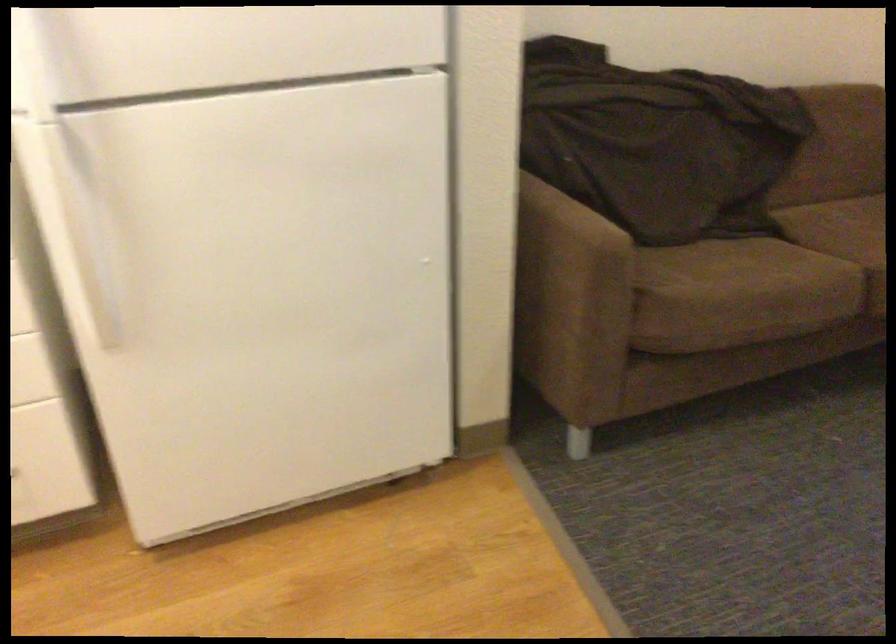
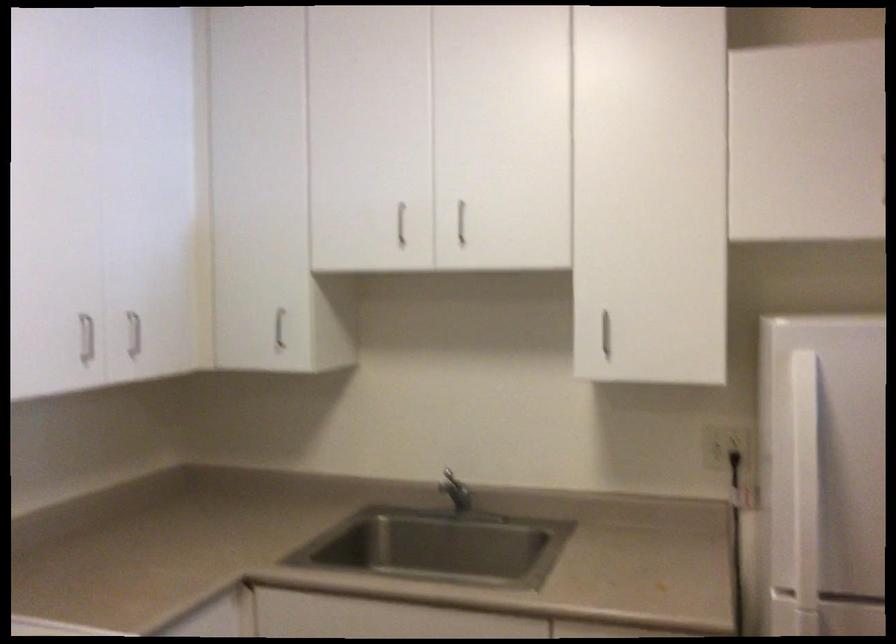
The images are taken continuously from a first-person perspective. In which direction is your viewpoint rotating?

The camera's rotation is toward left-up.